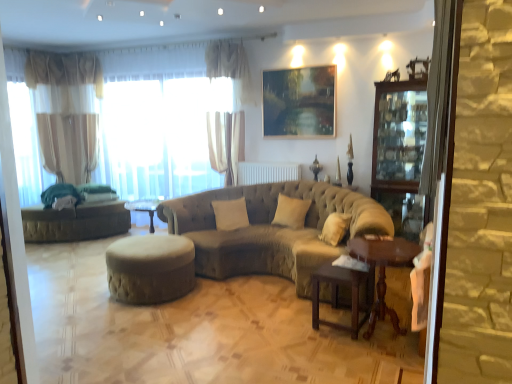
Question: Is stone textured screen door at right not near wooden polished table at lower right, the second table viewed from the left?

Choices:
 (A) yes
 (B) no

Answer: (A)

Question: Is stone textured screen door at right shorter than wooden polished table at lower right, the 1th table when ordered from right to left?

Choices:
 (A) yes
 (B) no

Answer: (B)

Question: Are stone textured screen door at right and wooden polished table at lower right, the 1th table when ordered from right to left, beside each other?

Choices:
 (A) yes
 (B) no

Answer: (B)

Question: From a real-world perspective, is stone textured screen door at right positioned under wooden polished table at lower right, the 1th table when ordered from right to left, based on gravity?

Choices:
 (A) yes
 (B) no

Answer: (B)

Question: Considering the relative positions of stone textured screen door at right and wooden polished table at lower right, the 1th table when ordered from right to left, in the image provided, is stone textured screen door at right behind wooden polished table at lower right, the 1th table when ordered from right to left,?

Choices:
 (A) yes
 (B) no

Answer: (B)

Question: Is stone textured screen door at right surrounding wooden polished table at lower right, the second table viewed from the left?

Choices:
 (A) yes
 (B) no

Answer: (B)

Question: Is stone textured screen door at right facing towards transparent glass cabinet at right?

Choices:
 (A) yes
 (B) no

Answer: (B)

Question: Does stone textured screen door at right have a greater height compared to transparent glass cabinet at right?

Choices:
 (A) yes
 (B) no

Answer: (A)

Question: Is transparent glass cabinet at right inside stone textured screen door at right?

Choices:
 (A) yes
 (B) no

Answer: (B)

Question: Considering the relative sizes of stone textured screen door at right and transparent glass cabinet at right in the image provided, is stone textured screen door at right shorter than transparent glass cabinet at right?

Choices:
 (A) yes
 (B) no

Answer: (B)

Question: Is stone textured screen door at right with transparent glass cabinet at right?

Choices:
 (A) yes
 (B) no

Answer: (B)

Question: Is stone textured screen door at right turned away from transparent glass cabinet at right?

Choices:
 (A) no
 (B) yes

Answer: (A)

Question: Is sheer fabric curtain at left, marked as the 1th curtain in a back-to-front arrangement, further to the viewer compared to translucent fabric at left?

Choices:
 (A) no
 (B) yes

Answer: (B)